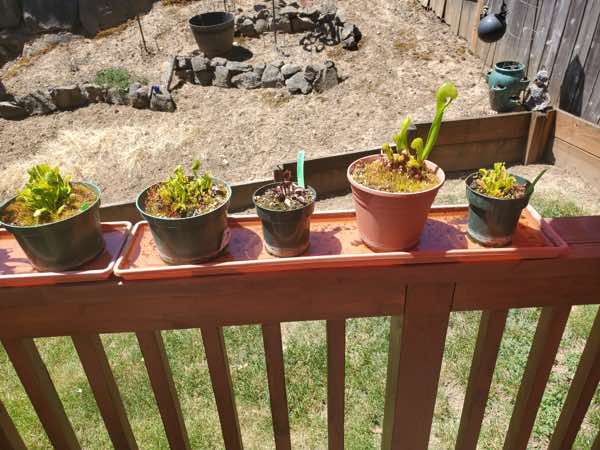
At what (x,y) coordinates should I click in order to perform the action: click on plant. Please return your answer as a coordinate pair (x, y). Looking at the image, I should click on (426, 153), (495, 182), (181, 189), (49, 191), (280, 197), (112, 77).